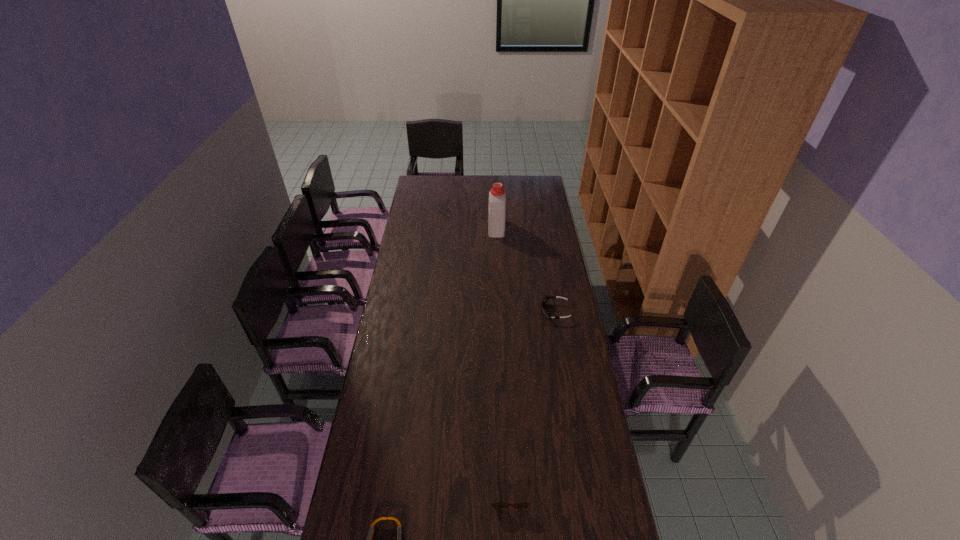
Identify the location of the farthest object. (497, 196).

Identify the location of the tallest object. (497, 196).

Locate an element on the screen. This screenshot has width=960, height=540. the rightmost object is located at coordinates (545, 299).

I want to click on the second farthest object, so [x=545, y=299].

Where is `spectacles`? spectacles is located at coordinates (495, 505).

Where is `free spot located on the handle side of the detergent`? The height and width of the screenshot is (540, 960). free spot located on the handle side of the detergent is located at coordinates (494, 195).

This screenshot has height=540, width=960. In order to click on vacant region located on the handle side of the detergent in this screenshot , I will do `click(494, 187)`.

Identify the location of free space located 0.100m on the handle side of the detergent. (495, 209).

Where is `vacant space located on the front and sides of the farther goggles`? The width and height of the screenshot is (960, 540). vacant space located on the front and sides of the farther goggles is located at coordinates (518, 312).

This screenshot has width=960, height=540. Identify the location of free region located 0.390m on the front and sides of the farther goggles. (455, 312).